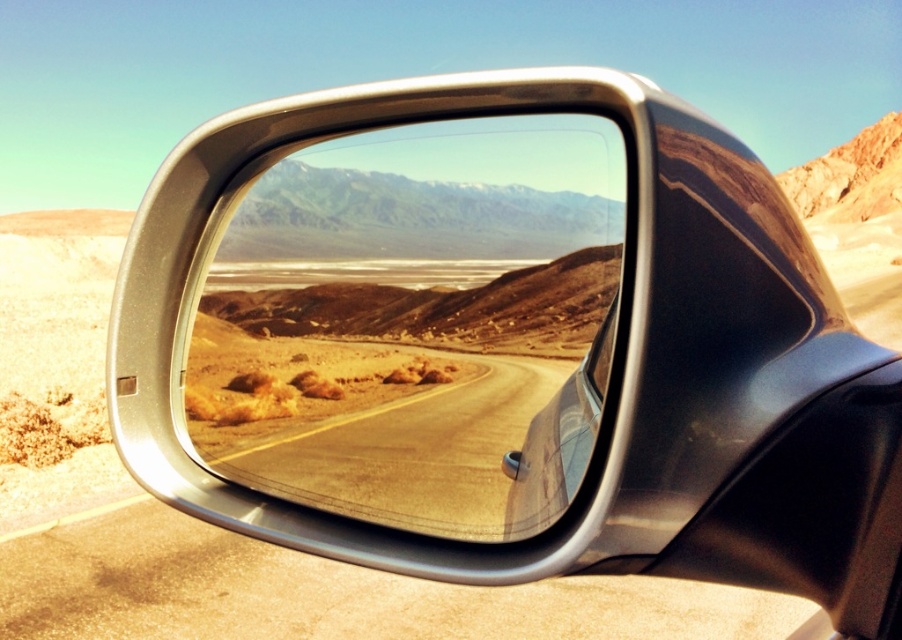
You are driving a car and want to check the road behind you using the mirror. Since the satin chrome mirror at center is bigger than the desert dirt road at center, can you see the entire road in the mirror?

The satin chrome mirror at center is bigger than the desert dirt road at center, so yes, you can see the entire road in the mirror.

You are driving a car with a side mirror. You notice a point at coordinates (417, 323). Based on the scene description, what object does this point correspond to?

The point at coordinates (417, 323) corresponds to the satin chrome mirror at center.